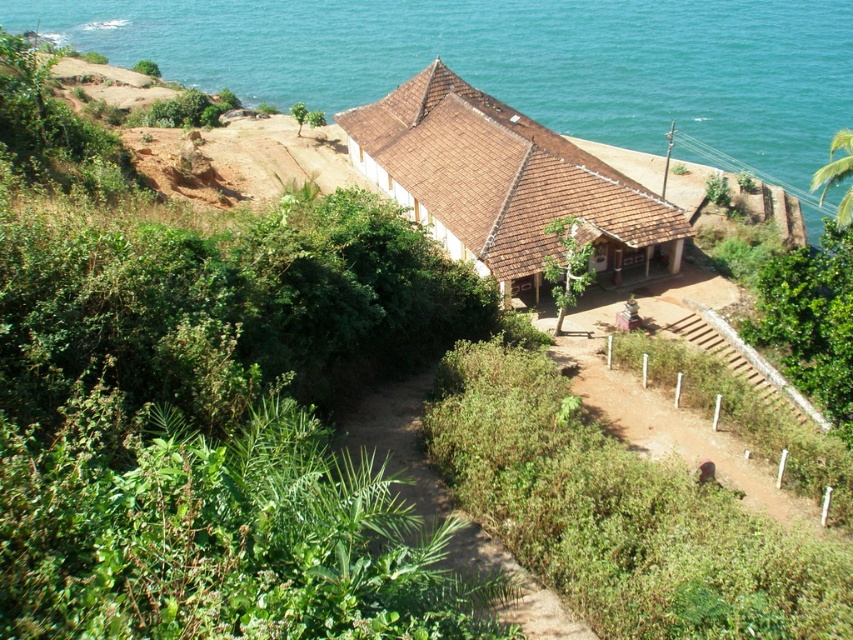
Question: Is blue water at upper center to the left of dried dirt path at center from the viewer's perspective?

Choices:
 (A) no
 (B) yes

Answer: (B)

Question: Estimate the real-world distances between objects in this image. Which object is farther from the blue water at upper center?

Choices:
 (A) dried dirt path at center
 (B) brown tiled hut at center

Answer: (A)

Question: Can you confirm if brown tiled hut at center is wider than dried dirt path at center?

Choices:
 (A) no
 (B) yes

Answer: (B)

Question: Which is nearer to the brown tiled hut at center?

Choices:
 (A) dried dirt path at center
 (B) blue water at upper center

Answer: (A)

Question: Which of the following is the closest to the observer?

Choices:
 (A) blue water at upper center
 (B) dried dirt path at center

Answer: (B)

Question: Does brown tiled hut at center have a smaller size compared to dried dirt path at center?

Choices:
 (A) no
 (B) yes

Answer: (A)